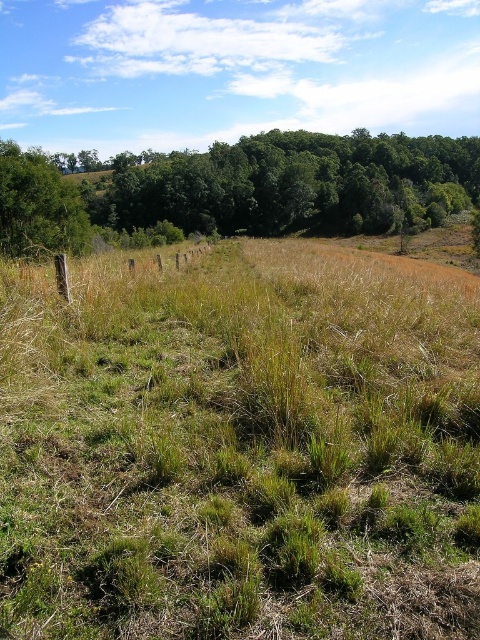
You are standing in the middle of the field and want to walk towards the green leafy tree at upper center. However, there is another green leafy tree at left in your path. Based on their positions, can you walk directly to the tree at upper center without going around the other tree?

The green leafy tree at left is behind the green leafy tree at upper center, so you can walk directly to the green leafy tree at upper center without needing to go around the green leafy tree at left.

You are standing in the middle of the grassy field and see the green leafy tree at upper center. If you walk directly towards it, will you encounter the wooden fence first?

The green leafy tree at upper center is located at point (245,188), so walking directly towards it would not require crossing the wooden fence first as the fence is positioned diagonally across the foreground field.

You are a hiker trying to determine which tree is taller between the green leafy tree at upper center and the green leafy tree at left. Based on the scene, which one is taller?

The green leafy tree at upper center is taller than the green leafy tree at left.